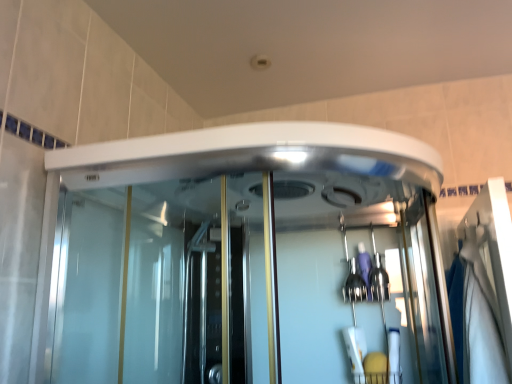
Where is `transparent glass shower door at center`? The image size is (512, 384). transparent glass shower door at center is located at coordinates [263, 276].

This screenshot has height=384, width=512. What do you see at coordinates (263, 276) in the screenshot?
I see `transparent glass shower door at center` at bounding box center [263, 276].

You are a GUI agent. You are given a task and a screenshot of the screen. Output one action in this format:
    pyautogui.click(x=<x>, y=<y>)
    Task: Click on the transparent glass shower door at center
    The width and height of the screenshot is (512, 384).
    Given the screenshot: What is the action you would take?
    pyautogui.click(x=263, y=276)